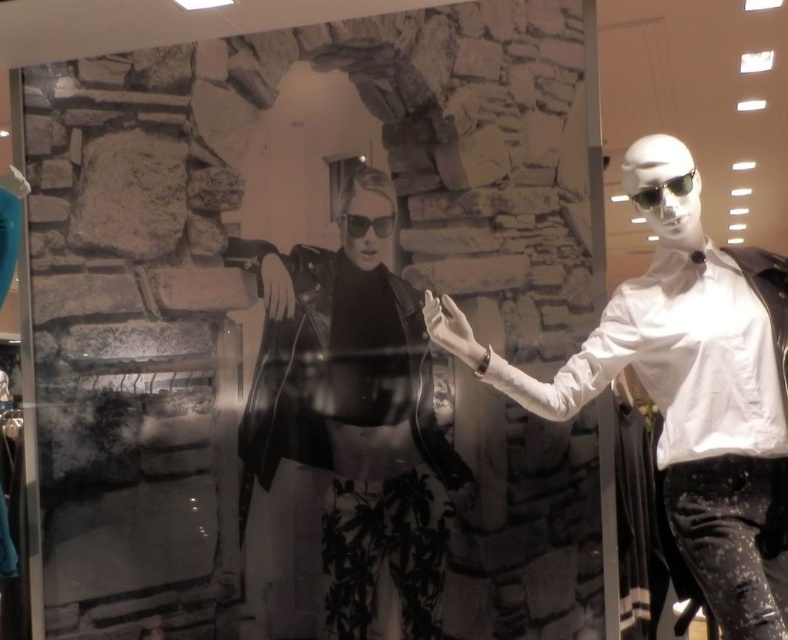
Question: Considering the real-world distances, which object is farthest from the black matte sunglasses at right?

Choices:
 (A) black leather jacket at center
 (B) white matte shirt at right
 (C) black matte sunglasses at center

Answer: (A)

Question: Among these objects, which one is farthest from the camera?

Choices:
 (A) white matte shirt at right
 (B) black matte sunglasses at center

Answer: (B)

Question: Considering the relative positions of black leather jacket at center and white matte shirt at right in the image provided, where is black leather jacket at center located with respect to white matte shirt at right?

Choices:
 (A) below
 (B) above

Answer: (A)

Question: Is white matte shirt at right to the right of black matte sunglasses at center from the viewer's perspective?

Choices:
 (A) no
 (B) yes

Answer: (B)

Question: Can you confirm if black leather jacket at center is thinner than black matte sunglasses at right?

Choices:
 (A) yes
 (B) no

Answer: (B)

Question: Which point is closer to the camera taking this photo?

Choices:
 (A) (679, 440)
 (B) (355, 232)

Answer: (A)